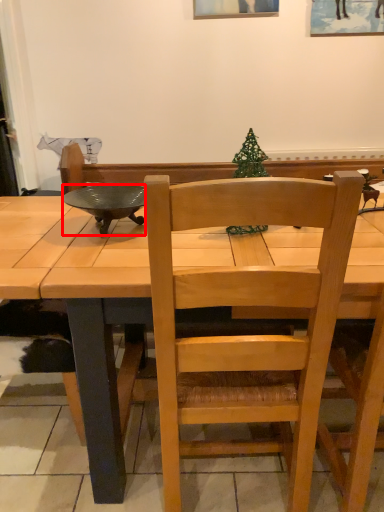
Question: From the image's perspective, what is the correct spatial positioning of bowl (annotated by the red box) in reference to chair?

Choices:
 (A) above
 (B) below

Answer: (A)